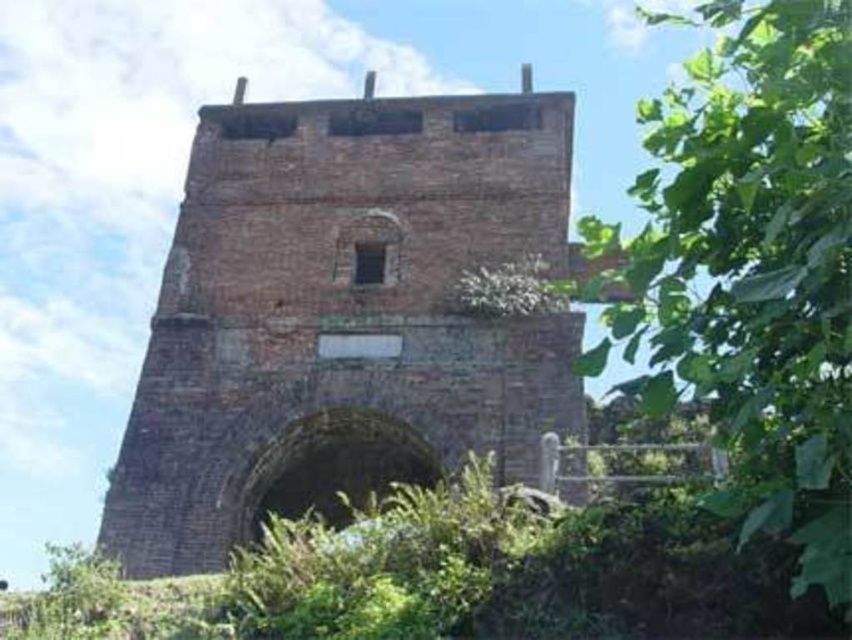
Does brown brick tower at center have a greater width compared to green leafy tree at right?

No, brown brick tower at center is not wider than green leafy tree at right.

You are a GUI agent. You are given a task and a screenshot of the screen. Output one action in this format:
    pyautogui.click(x=<x>, y=<y>)
    Task: Click on the brown brick tower at center
    This screenshot has width=852, height=640.
    Given the screenshot: What is the action you would take?
    pyautogui.click(x=343, y=314)

Does point (475, 195) lie behind point (848, 163)?

Yes, point (475, 195) is farther from viewer.

Where is `brown brick tower at center`? Image resolution: width=852 pixels, height=640 pixels. brown brick tower at center is located at coordinates (343, 314).